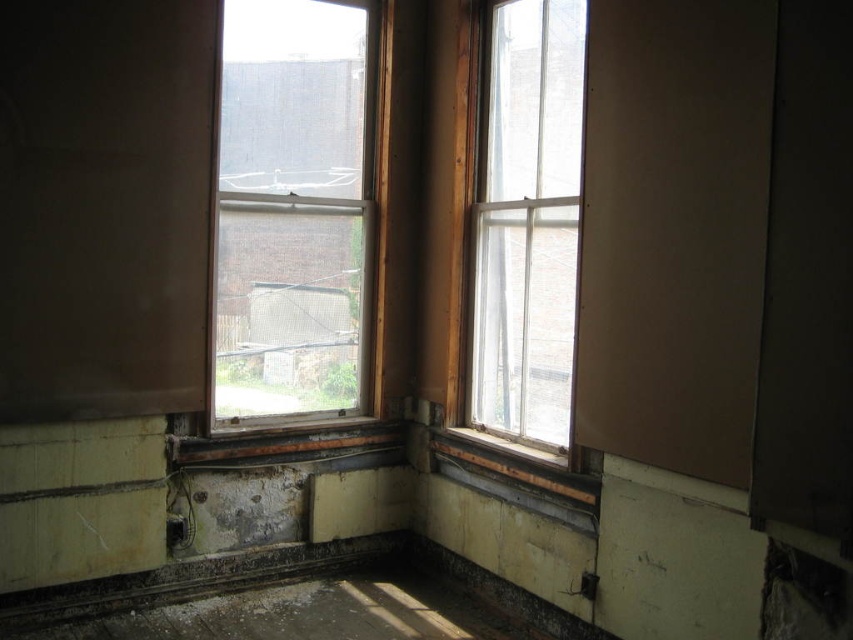
You are a painter who needs to place a ladder between the clear glass window at center and the clear glass window at upper right to reach a high point on the wall. The ladder is 1.2 meters long. Will the ladder fit between the two windows without touching them?

The clear glass window at center and clear glass window at upper right are 1.00 meters apart from each other. Since the ladder is 1.2 meters long, which is longer than the distance between the windows, the ladder will not fit between them without overlapping or touching the windows.

You are standing in the room and want to look outside through the clear glass window at center and the clear glass window at upper right. Which window is higher up in the room?

The clear glass window at center is higher up in the room than the clear glass window at upper right because it is positioned above it.

You are standing in the room and want to look outside through the clear glass window at center. Where should you move to in order to see the outside view through it?

The clear glass window at center is located at the 2D coordinates point (292, 211), so you should move to that position to see the outside view through it.